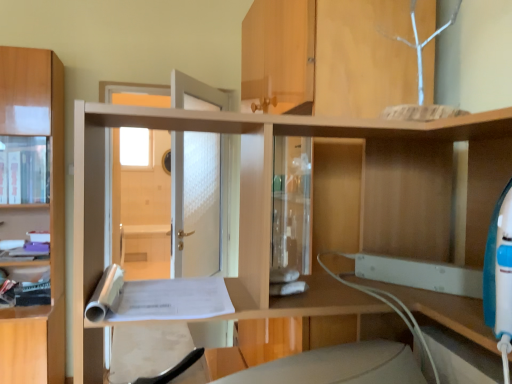
Question: Would you say light brown wood cabinet at left is inside or outside matte wood cabinet at left?

Choices:
 (A) inside
 (B) outside

Answer: (B)

Question: In the image, is light brown wood cabinet at left on the left side or the right side of matte wood cabinet at left?

Choices:
 (A) left
 (B) right

Answer: (B)

Question: Considering the positions of point (64, 331) and point (7, 200), is point (64, 331) closer or farther from the camera than point (7, 200)?

Choices:
 (A) farther
 (B) closer

Answer: (B)

Question: Considering the positions of matte wood cabinet at left and light brown wood cabinet at left in the image, is matte wood cabinet at left wider or thinner than light brown wood cabinet at left?

Choices:
 (A) thin
 (B) wide

Answer: (A)

Question: Based on their sizes in the image, would you say matte wood cabinet at left is bigger or smaller than light brown wood cabinet at left?

Choices:
 (A) small
 (B) big

Answer: (A)

Question: Is matte wood cabinet at left situated inside light brown wood cabinet at left or outside?

Choices:
 (A) inside
 (B) outside

Answer: (A)

Question: Is point (17, 175) closer or farther from the camera than point (61, 152)?

Choices:
 (A) farther
 (B) closer

Answer: (B)